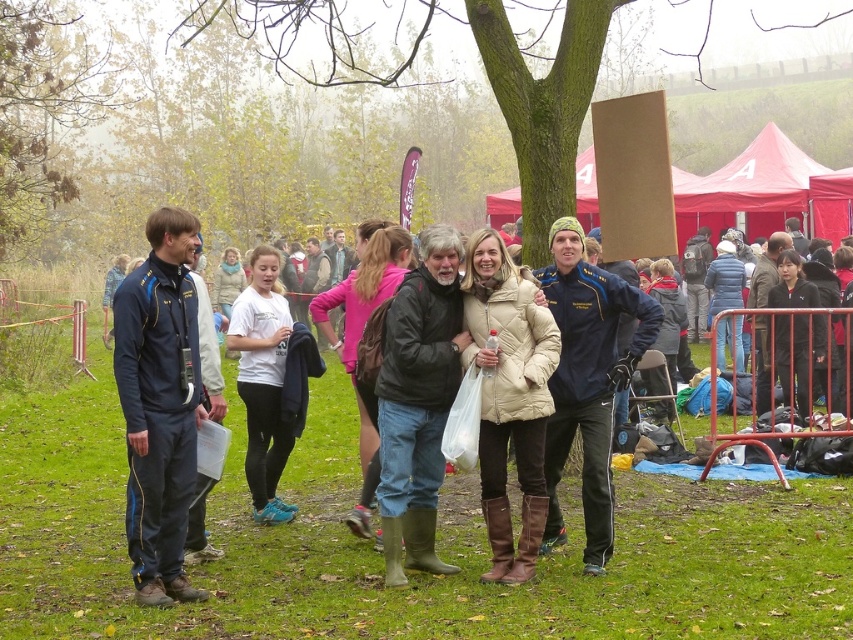
Question: Which of the following is the closest to the observer?

Choices:
 (A) (268, 484)
 (B) (532, 408)

Answer: (B)

Question: Does dark blue fabric jacket at left have a smaller size compared to beige quilted coat at center?

Choices:
 (A) no
 (B) yes

Answer: (B)

Question: Considering the real-world distances, which object is farthest from the white matte t-shirt at center?

Choices:
 (A) brown wood tree at upper center
 (B) pink fabric jacket at center
 (C) brown leafy tree at upper left
 (D) beige quilted coat at center

Answer: (C)

Question: Which object is positioned farthest from the beige quilted coat at center?

Choices:
 (A) dark blue fabric jacket at left
 (B) blue fabric jacket at center
 (C) white matte t-shirt at center

Answer: (C)

Question: Can you confirm if dark gray matte jacket at center is bigger than beige quilted coat at center?

Choices:
 (A) yes
 (B) no

Answer: (A)

Question: Is beige quilted coat at center closer to camera compared to brown leafy tree at upper left?

Choices:
 (A) yes
 (B) no

Answer: (A)